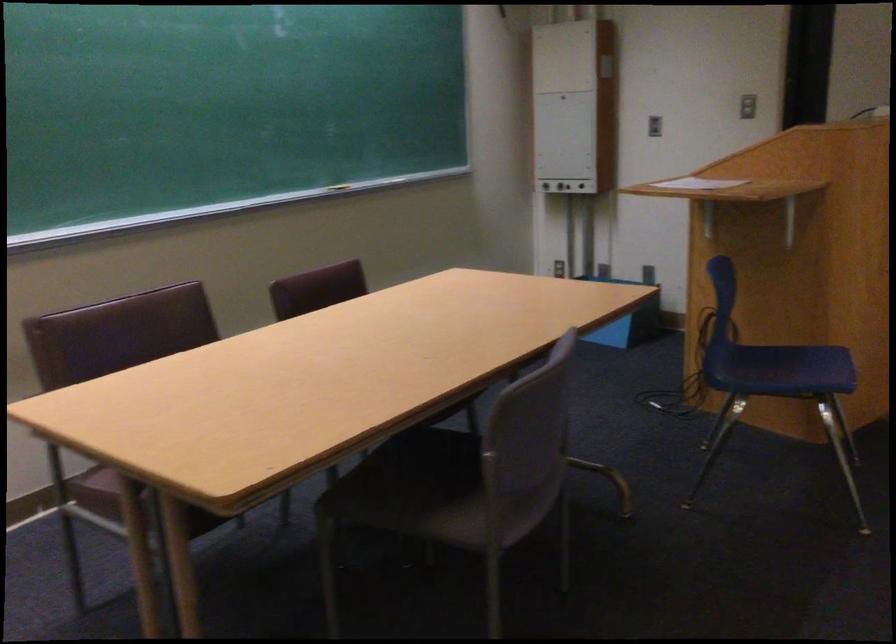
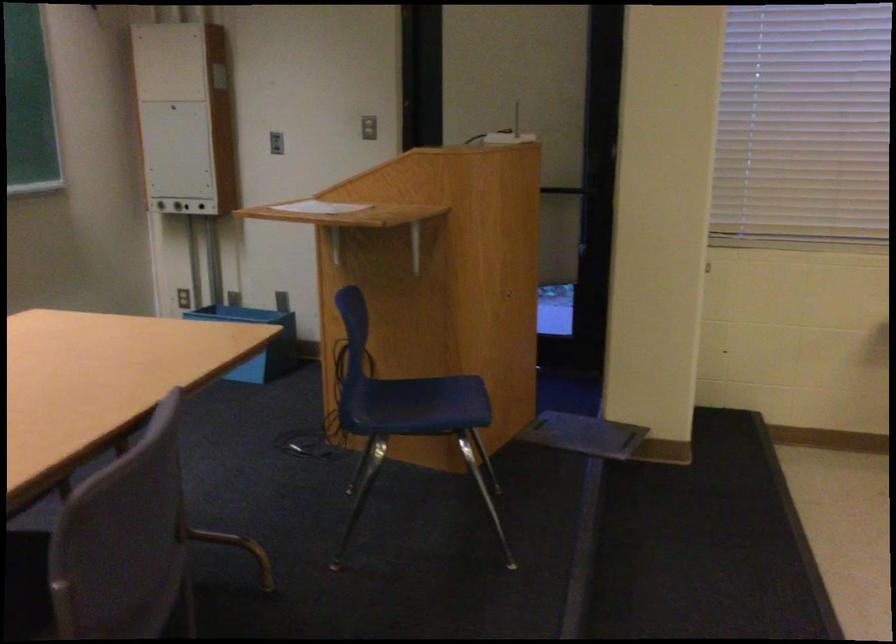
In a continuous first-person perspective shot, in which direction is the camera moving?

The cameraman walked toward right, forward.